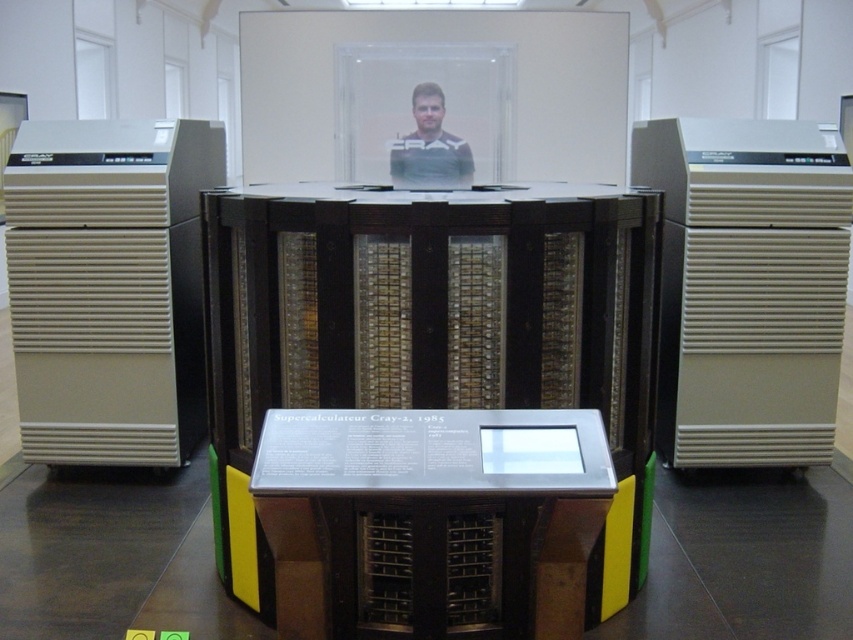
Question: Does matte beige computer tower at left have a smaller size compared to metallic/textured display at center?

Choices:
 (A) no
 (B) yes

Answer: (A)

Question: Which point is closer to the camera?

Choices:
 (A) (126, 385)
 (B) (633, 336)
 (C) (683, 172)
 (D) (531, 570)

Answer: (D)

Question: Considering the relative positions of wooden paneling supercomputer at center and metallic/textured display at center in the image provided, where is wooden paneling supercomputer at center located with respect to metallic/textured display at center?

Choices:
 (A) right
 (B) left

Answer: (B)

Question: Which of these objects is positioned farthest from the light brown leather jacket at center?

Choices:
 (A) matte beige computer tower at left
 (B) wooden paneling supercomputer at center
 (C) metallic/textured display at center
 (D) beige plastic computer tower at right

Answer: (C)

Question: Which is nearer to the beige plastic computer tower at right?

Choices:
 (A) metallic/textured display at center
 (B) wooden paneling supercomputer at center
 (C) light brown leather jacket at center

Answer: (B)

Question: Is matte beige computer tower at left above metallic/textured display at center?

Choices:
 (A) no
 (B) yes

Answer: (B)